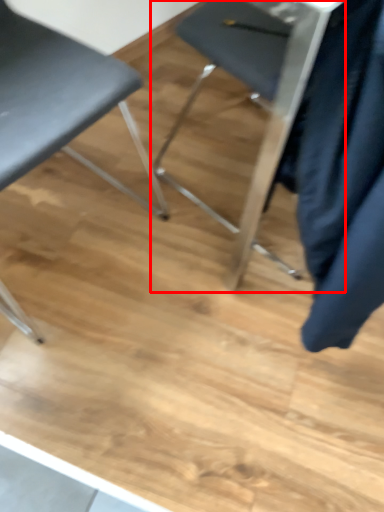
Question: From the image's perspective, where is chair (annotated by the red box) located in relation to chair in the image?

Choices:
 (A) below
 (B) above

Answer: (B)